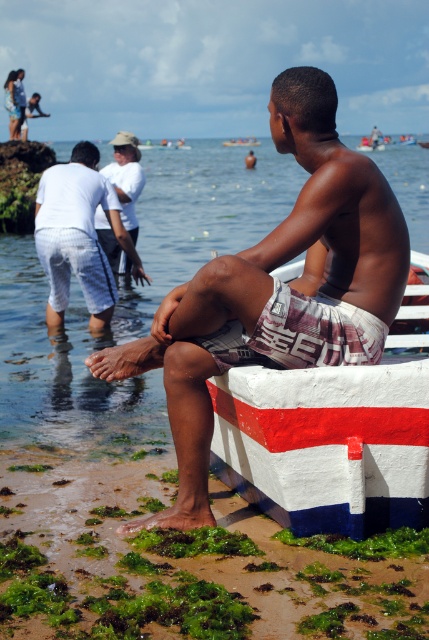
Question: Which of these objects is positioned closest to the white textured shorts at center?

Choices:
 (A) white cotton shirt at upper left
 (B) white painted wood boat at center
 (C) white cotton shorts at center

Answer: (C)

Question: Which point is closer to the camera?

Choices:
 (A) white textured shorts at center
 (B) white cotton shorts at center
 (C) white painted wood boat at center
 (D) white cotton shirt at upper left

Answer: (A)

Question: Where is white textured shorts at center located in relation to white cotton shorts at center in the image?

Choices:
 (A) above
 (B) below

Answer: (B)

Question: Does white cotton shorts at center appear under white painted wood boat at center?

Choices:
 (A) yes
 (B) no

Answer: (A)

Question: Among these objects, which one is farthest from the camera?

Choices:
 (A) white painted wood boat at center
 (B) white cotton shirt at upper left

Answer: (A)

Question: Is white textured shorts at center positioned behind white cotton shorts at center?

Choices:
 (A) yes
 (B) no

Answer: (B)